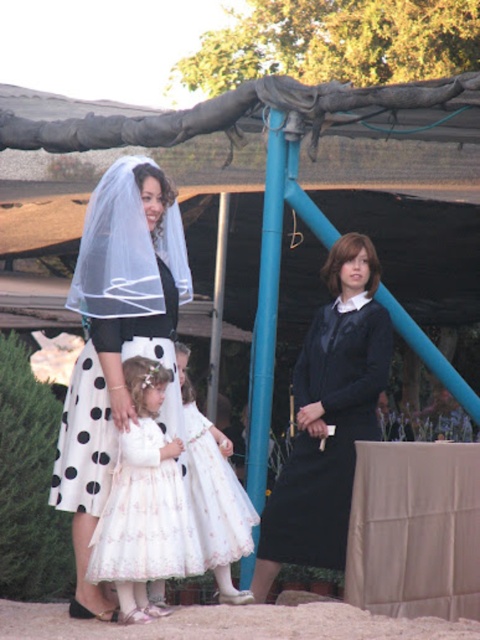
Question: Where is matte black dress at center located in relation to white satin dress at center in the image?

Choices:
 (A) above
 (B) below

Answer: (A)

Question: Is matte black dress at center to the left of white satin dress at center from the viewer's perspective?

Choices:
 (A) yes
 (B) no

Answer: (B)

Question: Which point is farther to the camera?

Choices:
 (A) (199, 506)
 (B) (173, 484)

Answer: (A)

Question: Which object is positioned farthest from the white satin dress at center?

Choices:
 (A) white sheer veil at upper left
 (B) matte black dress at center

Answer: (B)

Question: Which point is farther to the camera?

Choices:
 (A) white satin dress at center
 (B) matte black dress at center

Answer: (B)

Question: In this image, where is white sheer veil at upper left located relative to white satin dress at center?

Choices:
 (A) below
 (B) above

Answer: (B)